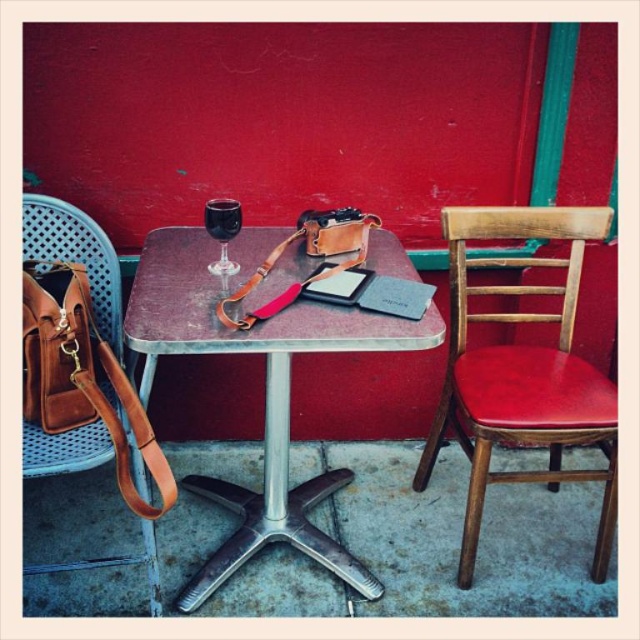
You are standing at the edge of the rustic wood table at center and want to place a small object exactly at point (264, 387). Is this point located on the table?

Yes, the point (264, 387) is on the rustic wood table at center, so you can place the object there.

You are a customer at the outdoor cafe and want to place your 12 inch laptop on the rustic wood table at center. Considering the height of the table compared to the brown leather bag at left, will the laptop fit comfortably on the table without hanging off the edge?

The rustic wood table at center is not as tall as the brown leather bag at left, but the height comparison does not directly indicate the table surface size. The laptop may fit, but the table height being lower than the bag does not ensure sufficient surface space. Check the table dimensions for confirmation.